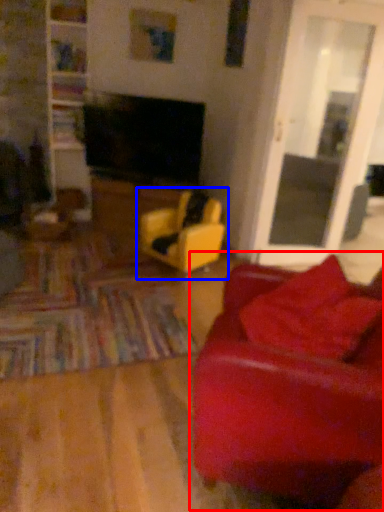
Question: Which object appears closest to the camera in this image, studio couch (highlighted by a red box) or chair (highlighted by a blue box)?

Choices:
 (A) studio couch
 (B) chair

Answer: (A)